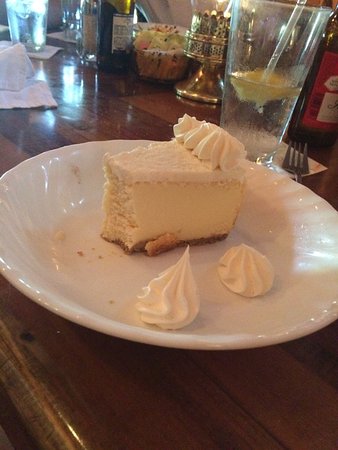
You are a GUI agent. You are given a task and a screenshot of the screen. Output one action in this format:
    pyautogui.click(x=<x>, y=<y>)
    Task: Click on the plate
    The image size is (338, 450).
    Given the screenshot: What is the action you would take?
    point(236,334)